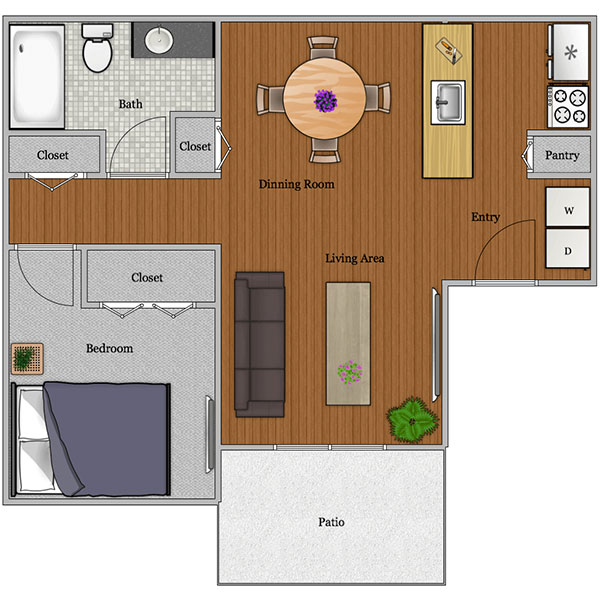
The height and width of the screenshot is (600, 600). Find the location of `sliding doors`. sliding doors is located at coordinates (329, 447).